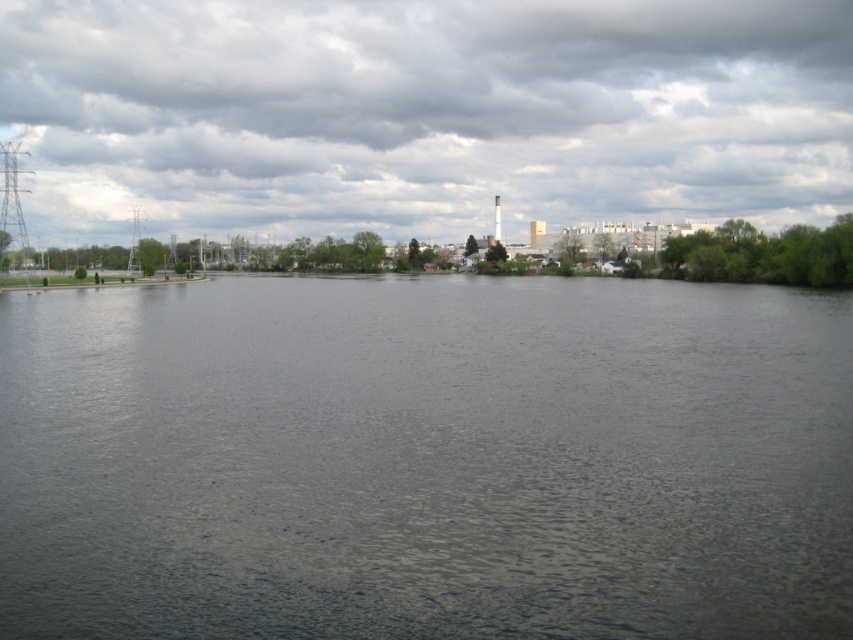
Question: Does dark gray water at center appear over dark cloudy sky at upper center?

Choices:
 (A) yes
 (B) no

Answer: (B)

Question: Is dark gray water at center below dark cloudy sky at upper center?

Choices:
 (A) yes
 (B) no

Answer: (A)

Question: Which object appears closest to the camera in this image?

Choices:
 (A) dark gray water at center
 (B) dark cloudy sky at upper center

Answer: (A)

Question: Is dark gray water at center to the right of dark cloudy sky at upper center from the viewer's perspective?

Choices:
 (A) yes
 (B) no

Answer: (A)

Question: Which point appears closest to the camera in this image?

Choices:
 (A) (558, 330)
 (B) (496, 38)

Answer: (A)